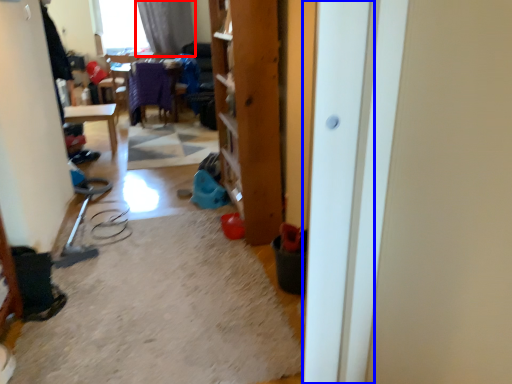
Question: Which of the following is the closest to the observer, curtain (highlighted by a red box) or screen door (highlighted by a blue box)?

Choices:
 (A) curtain
 (B) screen door

Answer: (B)